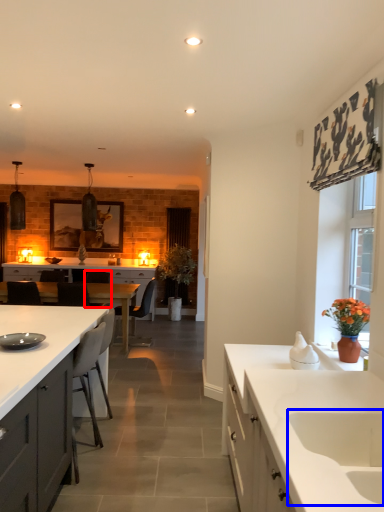
Question: Among these objects, which one is nearest to the camera, chair (highlighted by a red box) or sink (highlighted by a blue box)?

Choices:
 (A) chair
 (B) sink

Answer: (B)